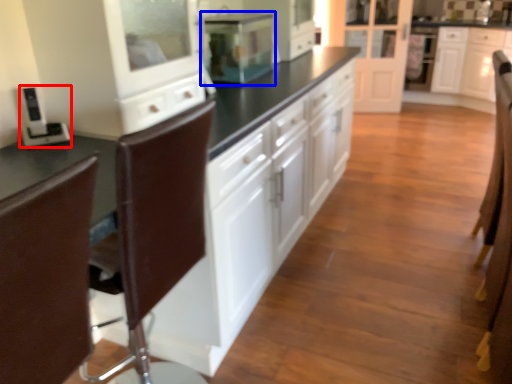
Question: Among these objects, which one is nearest to the camera, appliance (highlighted by a red box) or home appliance (highlighted by a blue box)?

Choices:
 (A) appliance
 (B) home appliance

Answer: (A)